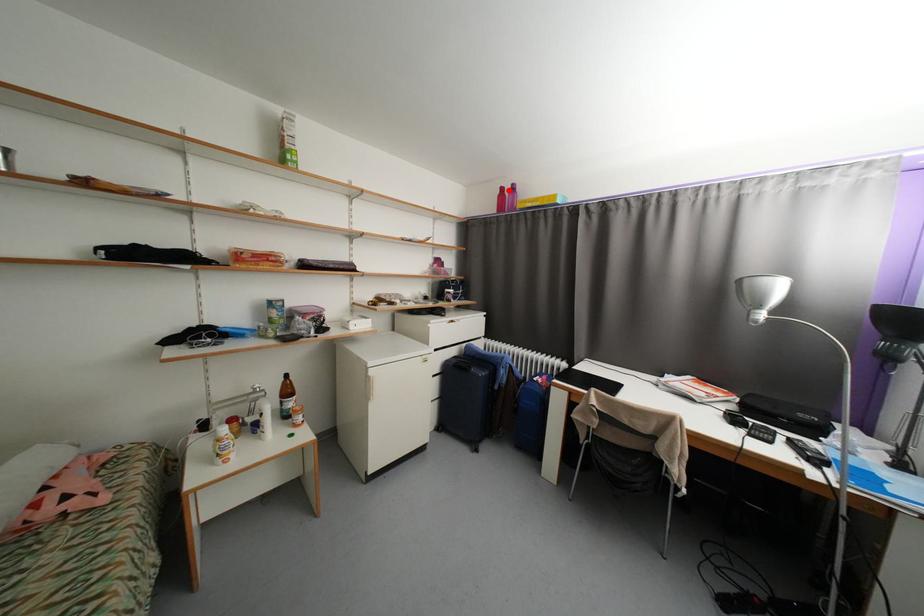
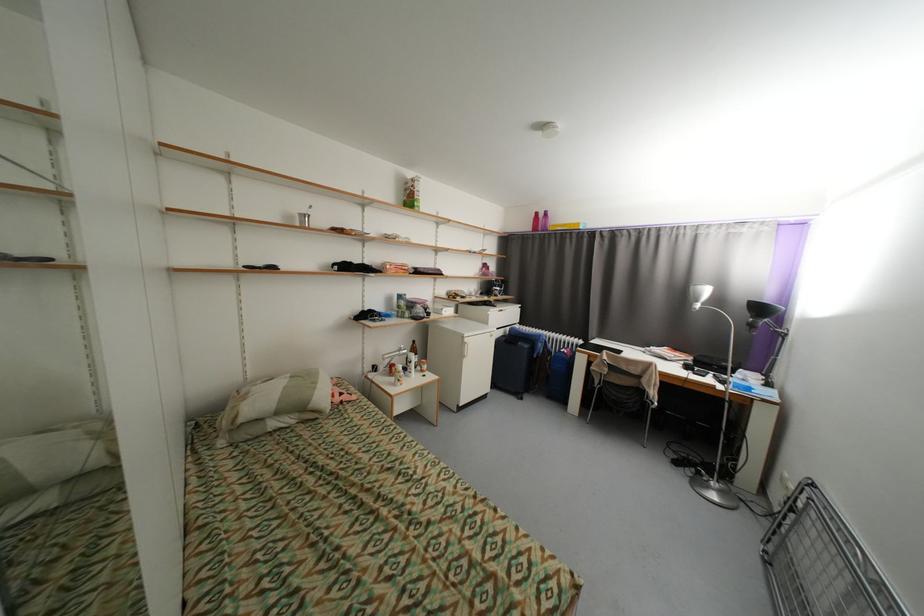
Find the pixel in the second image that matches the highlighted location in the first image.

(542, 215)